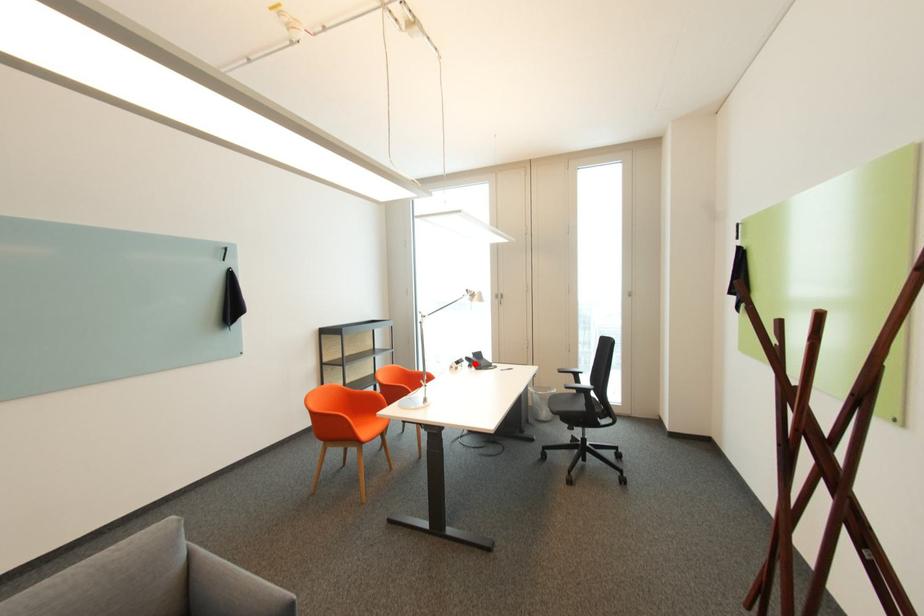
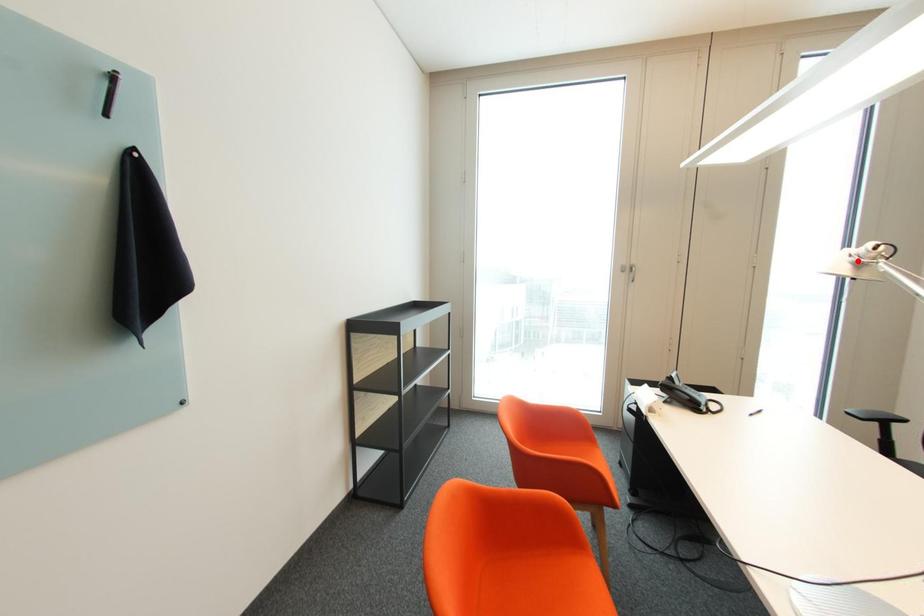
I am providing you with two images of the same scene from different viewpoints. A red point is marked on the first image and another point is marked on the second image. Does the point marked in image1 correspond to the same location as the one in image2?

No